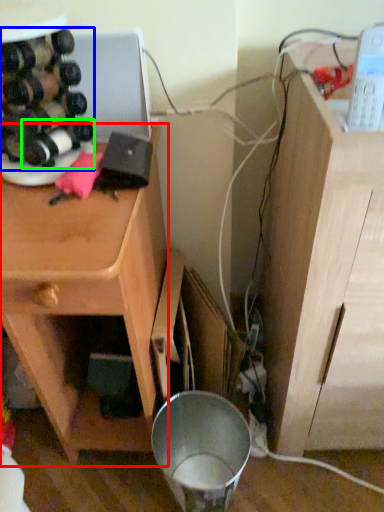
Question: Considering the real-world distances, which object is closest to cabinetry (highlighted by a red box)? wine bottle (highlighted by a blue box) or wine bottle (highlighted by a green box).

Choices:
 (A) wine bottle
 (B) wine bottle

Answer: (A)